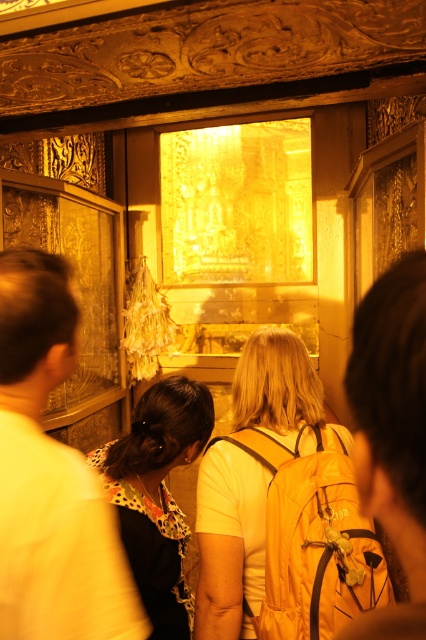
You are a tour guide in the museum and want to point out an object located at point (409, 481) to your visitors. The visitors are standing 20 inches away from the camera. Can they see the object clearly?

The point (409, 481) is 19.20 inches away from the camera, which is closer than the visitors standing 20 inches away. Therefore, the visitors can see the object clearly as it is within their line of sight.